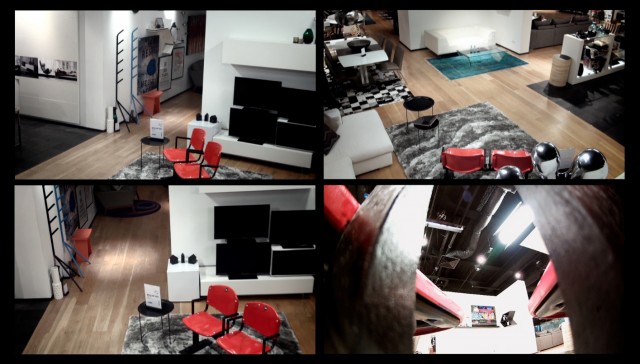
You are a GUI agent. You are given a task and a screenshot of the screen. Output one action in this format:
    pyautogui.click(x=<x>, y=<y>)
    Task: Click on the monitor
    The width and height of the screenshot is (640, 364).
    Given the screenshot: What is the action you would take?
    pyautogui.click(x=249, y=233)